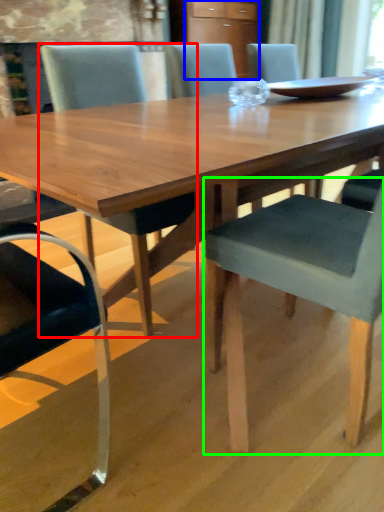
Question: Which is farther away from chair (highlighted by a red box)? cabinetry (highlighted by a blue box) or chair (highlighted by a green box)?

Choices:
 (A) cabinetry
 (B) chair

Answer: (A)